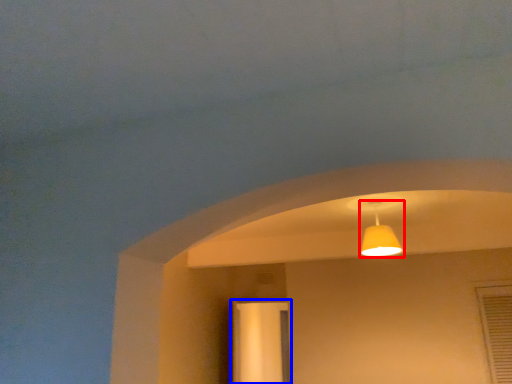
Question: Which of the following is the closest to the observer, lamp (highlighted by a red box) or screen door (highlighted by a blue box)?

Choices:
 (A) lamp
 (B) screen door

Answer: (A)